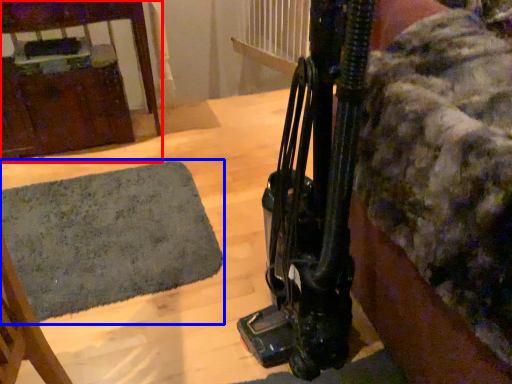
Question: Which point is closer to the camera, furniture (highlighted by a red box) or mat (highlighted by a blue box)?

Choices:
 (A) furniture
 (B) mat

Answer: (B)